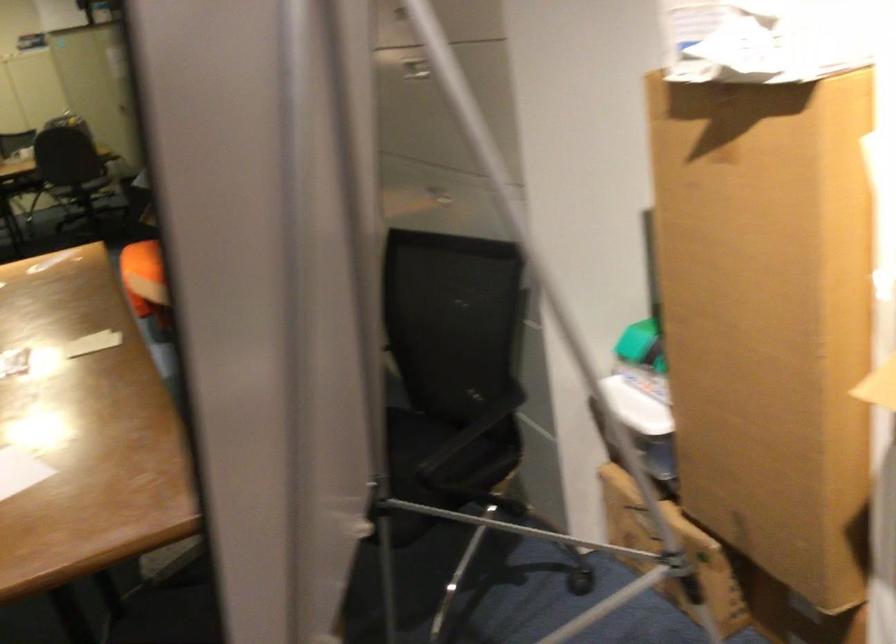
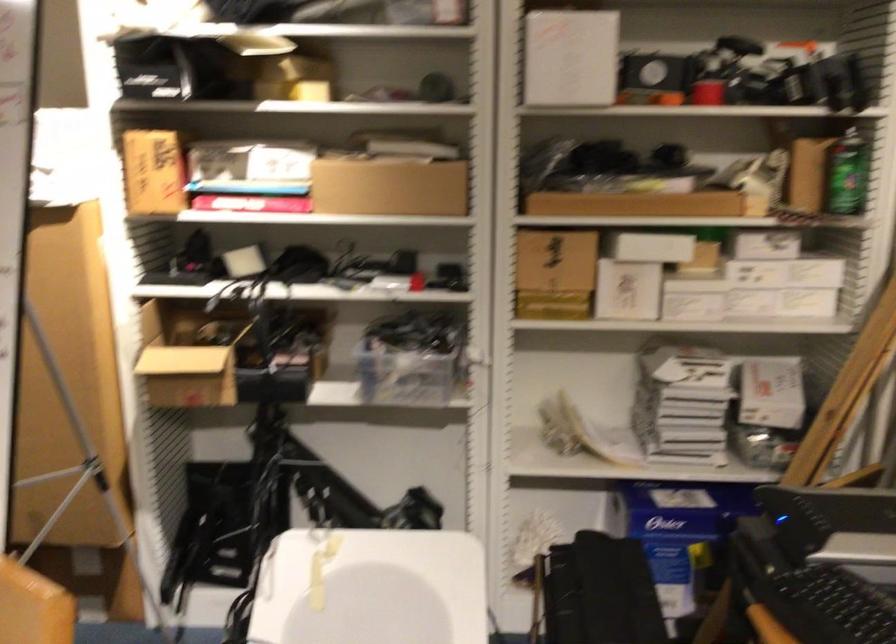
In the second image, find the point that corresponds to point (621, 456) in the first image.

(73, 412)